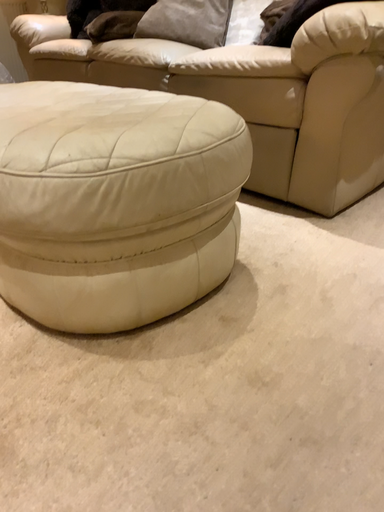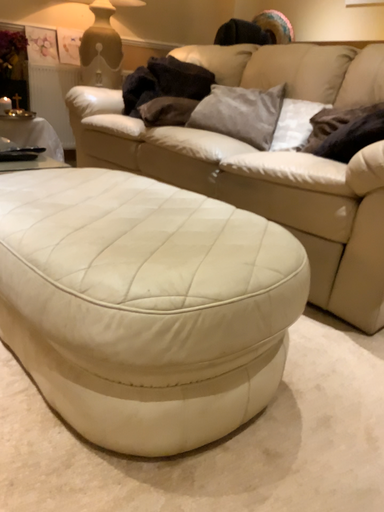
Question: Which way did the camera rotate in the video?

Choices:
 (A) rotated upward
 (B) rotated downward

Answer: (A)